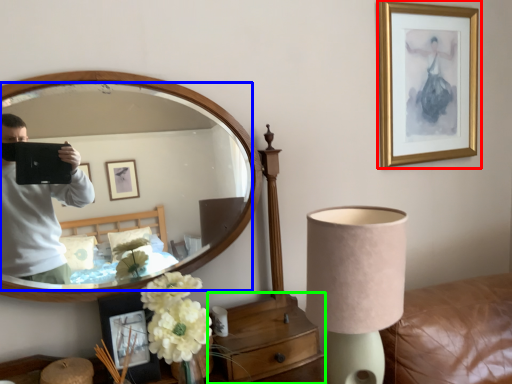
Question: Considering the real-world distances, which object is farthest from picture frame (highlighted by a red box)? mirror (highlighted by a blue box) or dresser (highlighted by a green box)?

Choices:
 (A) mirror
 (B) dresser

Answer: (B)